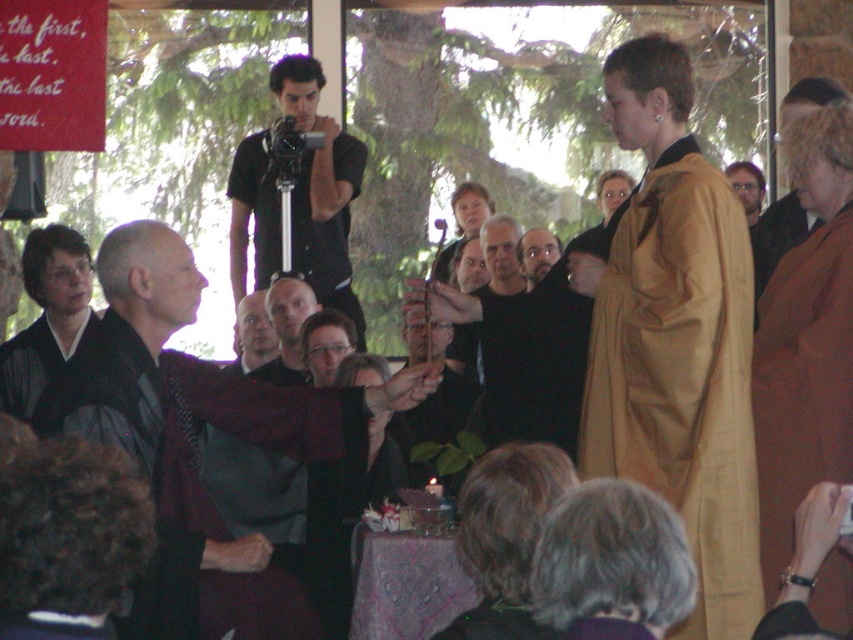
Does golden silk robe at center appear on the left side of maroon velvet robe at center?

No, golden silk robe at center is not to the left of maroon velvet robe at center.

Does golden silk robe at center come in front of maroon velvet robe at center?

Yes.

Is point (664, 342) more distant than point (212, 611)?

Yes, point (664, 342) is farther from viewer.

Locate an element on the screen. This screenshot has height=640, width=853. golden silk robe at center is located at coordinates (682, 376).

Is point (195, 298) in front of point (239, 273)?

Yes, it is.

Can you confirm if maroon silk robe at center is positioned to the right of black matte camera at center?

Yes, maroon silk robe at center is to the right of black matte camera at center.

Locate an element on the screen. maroon silk robe at center is located at coordinates (192, 408).

The width and height of the screenshot is (853, 640). Identify the location of maroon silk robe at center. (192, 408).

Which of these two, maroon silk robe at center or brown woolen robe at right, stands shorter?

With less height is maroon silk robe at center.

Does maroon silk robe at center appear over brown woolen robe at right?

No, maroon silk robe at center is not above brown woolen robe at right.

Is point (148, 360) farther from viewer compared to point (780, 260)?

No, it is not.

Where is `maroon silk robe at center`? maroon silk robe at center is located at coordinates (192, 408).